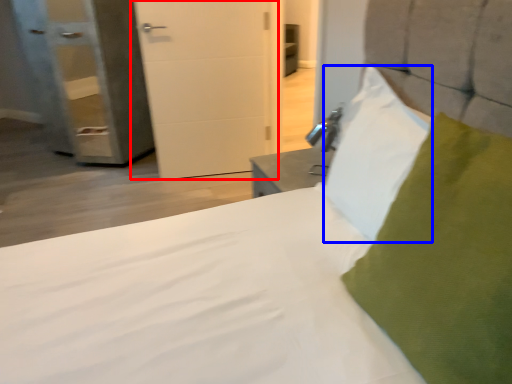
Question: Which object is closer to the camera taking this photo, door (highlighted by a red box) or pillow (highlighted by a blue box)?

Choices:
 (A) door
 (B) pillow

Answer: (B)